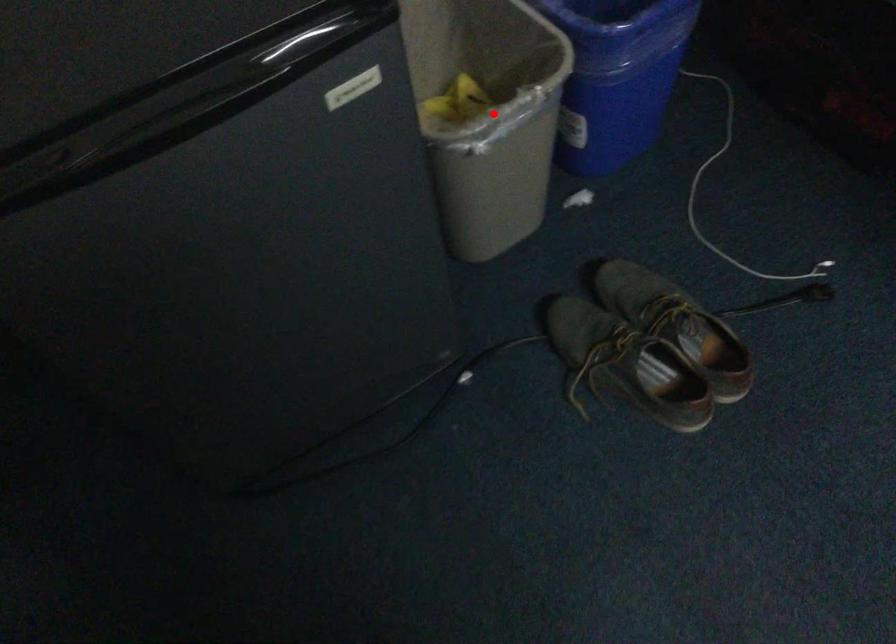
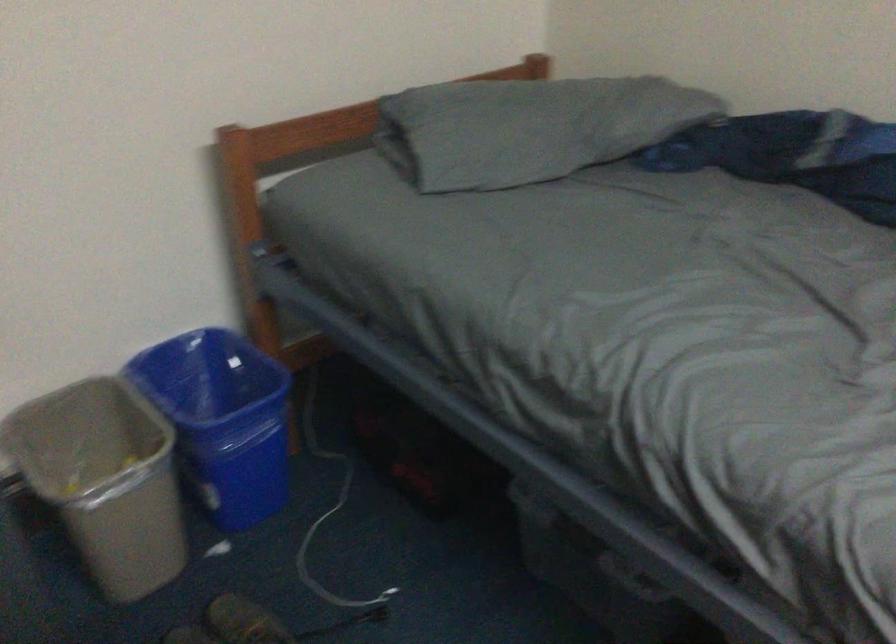
Find the pixel in the second image that matches the highlighted location in the first image.

(104, 480)